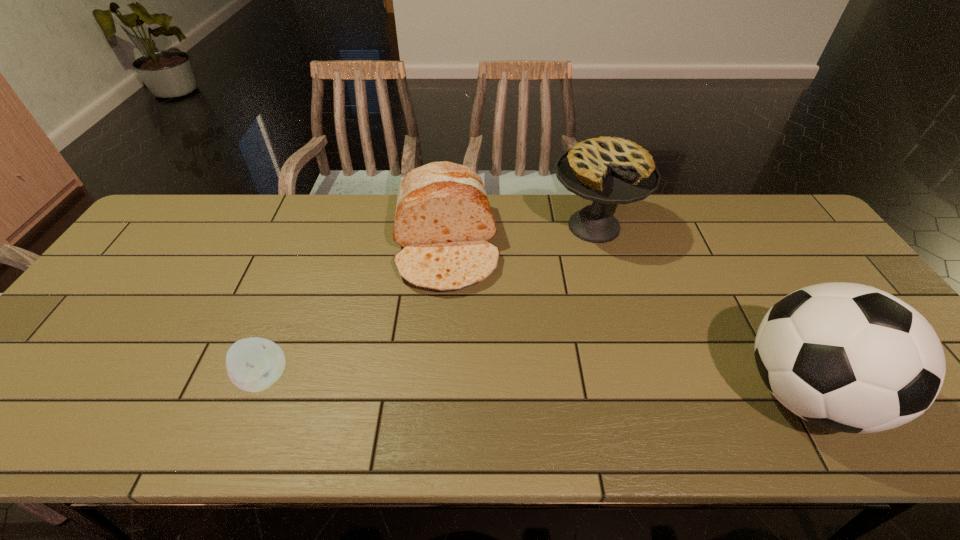
Identify the location of the shortest object. The image size is (960, 540). (253, 364).

Where is `the leftmost object`? This screenshot has width=960, height=540. the leftmost object is located at coordinates (253, 364).

Image resolution: width=960 pixels, height=540 pixels. I want to click on the rightmost object, so coord(848,357).

At what (x,y) coordinates should I click in order to perform the action: click on the third object from right to left. Please return your answer as a coordinate pair (x, y). Looking at the image, I should click on (443, 220).

Where is `bread`? Image resolution: width=960 pixels, height=540 pixels. bread is located at coordinates (443, 220).

Find the location of a particular element. the second object from right to left is located at coordinates (607, 170).

Where is `blank area located on the right of the apple`? blank area located on the right of the apple is located at coordinates (382, 378).

Locate an element on the screen. The image size is (960, 540). free space located on the right of the soccer ball is located at coordinates (900, 393).

This screenshot has width=960, height=540. Find the location of `free location located at the sliced end of the bread`. free location located at the sliced end of the bread is located at coordinates pos(450,314).

Identify the location of vacant space located at the sliced end of the bread. (456, 382).